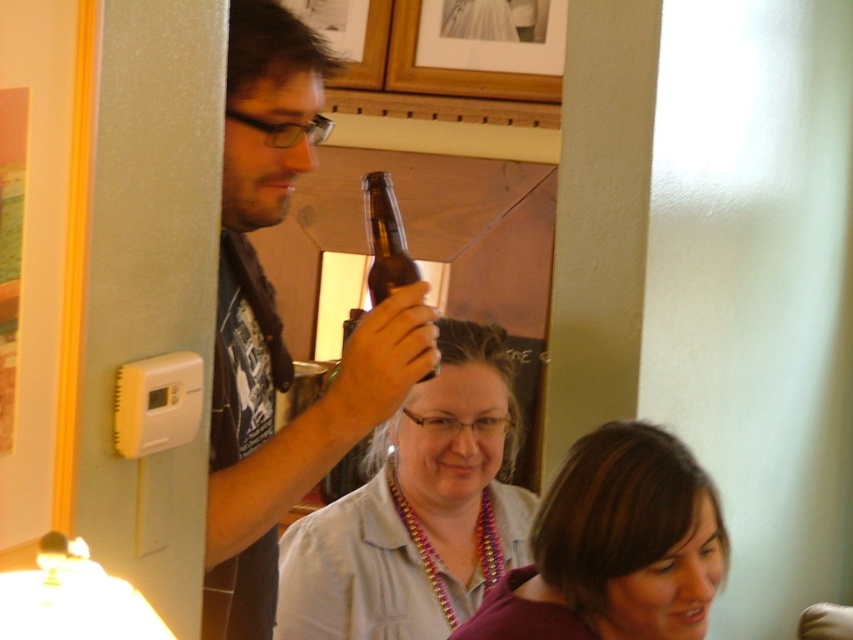
Question: Is matte black shirt at upper left above matte purple shirt at lower center?

Choices:
 (A) no
 (B) yes

Answer: (B)

Question: Which object is the farthest from the purple beaded necklace at center?

Choices:
 (A) matte purple shirt at lower center
 (B) brown glass bottle at upper center

Answer: (B)

Question: Can you confirm if matte black shirt at upper left is thinner than brown glass bottle at upper center?

Choices:
 (A) no
 (B) yes

Answer: (A)

Question: From the image, what is the correct spatial relationship of purple beaded necklace at center in relation to matte purple shirt at lower center?

Choices:
 (A) right
 (B) left

Answer: (B)

Question: Among these points, which one is farthest from the camera?

Choices:
 (A) (386, 177)
 (B) (631, 609)

Answer: (A)

Question: Which object is positioned farthest from the brown glass bottle at upper center?

Choices:
 (A) matte purple shirt at lower center
 (B) purple beaded necklace at center

Answer: (B)